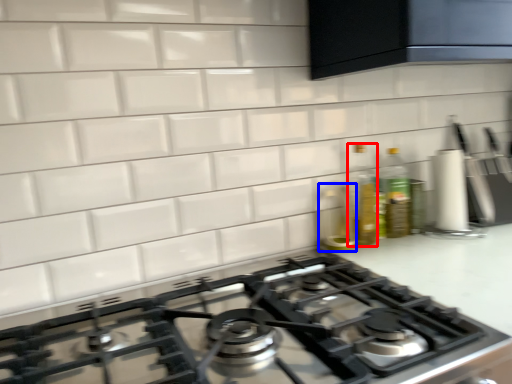
Question: Which object is closer to the camera taking this photo, bottle (highlighted by a red box) or appliance (highlighted by a blue box)?

Choices:
 (A) bottle
 (B) appliance

Answer: (B)